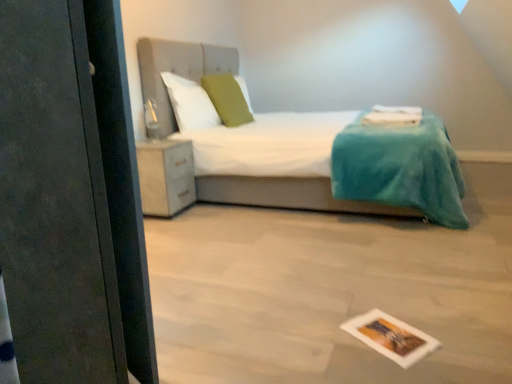
Find the location of `free space that is to the left of printed paper postcard at lower center`. free space that is to the left of printed paper postcard at lower center is located at coordinates (327, 339).